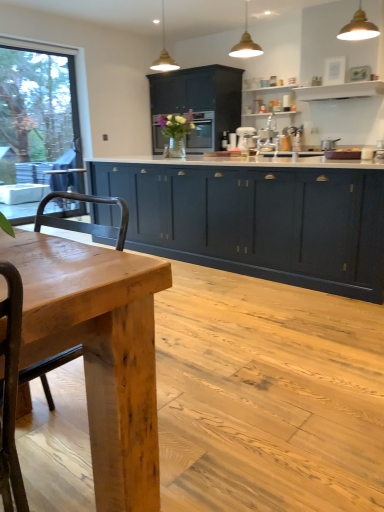
In order to face metallic gold pendant light at upper center, acting as the first light fixture starting from the front, should I rotate leftwards or rightwards?

It's best to rotate right around 21.420 degrees.

The image size is (384, 512). What do you see at coordinates (358, 27) in the screenshot?
I see `metallic gold pendant light at upper center, the 1th light fixture positioned from the right` at bounding box center [358, 27].

Identify the location of white glossy exhaust hood at upper center. Image resolution: width=384 pixels, height=512 pixels. (332, 97).

The image size is (384, 512). What do you see at coordinates (246, 42) in the screenshot?
I see `matte gold pendant light at upper center, which is the second light fixture from left to right` at bounding box center [246, 42].

Describe the element at coordinates (176, 131) in the screenshot. I see `translucent glass vase at center` at that location.

Identify the location of matte dark blue cabinets at center, the first cabinetry when ordered from bottom to top. The height and width of the screenshot is (512, 384). (258, 220).

Is white glossy exhaust hood at upper center oriented towards transparent glass window at left?

No, white glossy exhaust hood at upper center is not facing towards transparent glass window at left.

Considering the sizes of white glossy exhaust hood at upper center and transparent glass window at left in the image, is white glossy exhaust hood at upper center taller or shorter than transparent glass window at left?

white glossy exhaust hood at upper center is shorter than transparent glass window at left.

In terms of size, does white glossy exhaust hood at upper center appear bigger or smaller than transparent glass window at left?

white glossy exhaust hood at upper center is smaller than transparent glass window at left.

Which is behind, point (351, 98) or point (214, 116)?

The point (214, 116) is farther from the camera.

Could you tell me if white glossy exhaust hood at upper center is facing matte black oven at center?

No.

Does white glossy exhaust hood at upper center have a lesser width compared to matte black oven at center?

Correct, the width of white glossy exhaust hood at upper center is less than that of matte black oven at center.

Is point (175, 128) closer or farther from the camera than point (246, 137)?

Point (175, 128) is closer to the camera than point (246, 137).

I want to click on floral arrangement that appears in front of the satin silver coffee machine at center, so click(176, 131).

Between translucent glass vase at center and satin silver coffee machine at center, which one is positioned behind?

satin silver coffee machine at center is behind.

From the gold metallic pendant light at upper center, the 1th light fixture positioned from the left, count 2nd light fixture to the right and point to it. Please provide its 2D coordinates.

[(358, 27)]

From a real-world perspective, is metallic gold pendant light at upper center, the 1th light fixture positioned from the right, under gold metallic pendant light at upper center, the third light fixture positioned from the front?

Indeed, from a real-world perspective, metallic gold pendant light at upper center, the 1th light fixture positioned from the right, is positioned beneath gold metallic pendant light at upper center, the third light fixture positioned from the front.

Can you confirm if metallic gold pendant light at upper center, the 3th light fixture positioned from the left, is shorter than gold metallic pendant light at upper center, arranged as the first light fixture when viewed from the back?

Indeed, metallic gold pendant light at upper center, the 3th light fixture positioned from the left, has a lesser height compared to gold metallic pendant light at upper center, arranged as the first light fixture when viewed from the back.

Is metallic gold pendant light at upper center, marked as the 3th light fixture in a back-to-front arrangement, inside or outside of gold metallic pendant light at upper center, the 1th light fixture positioned from the left?

metallic gold pendant light at upper center, marked as the 3th light fixture in a back-to-front arrangement, lies outside gold metallic pendant light at upper center, the 1th light fixture positioned from the left.

How much distance is there between matte black oven at center and satin silver coffee machine at center?

The distance of matte black oven at center from satin silver coffee machine at center is 27.97 inches.

Would you say matte black oven at center is outside satin silver coffee machine at center?

Indeed, matte black oven at center is completely outside satin silver coffee machine at center.

Consider the image. Considering the sizes of objects matte black oven at center and satin silver coffee machine at center in the image provided, who is smaller, matte black oven at center or satin silver coffee machine at center?

satin silver coffee machine at center.

Which of these two, natural wood table at center or gold metallic pendant light at upper center, arranged as the first light fixture when viewed from the back, is wider?

natural wood table at center.

From a real-world perspective, which is physically below, natural wood table at center or gold metallic pendant light at upper center, the 1th light fixture positioned from the left?

In real-world perspective, natural wood table at center is lower.

Considering the relative sizes of natural wood table at center and gold metallic pendant light at upper center, the third light fixture in the right-to-left sequence, in the image provided, is natural wood table at center shorter than gold metallic pendant light at upper center, the third light fixture in the right-to-left sequence,?

Incorrect, the height of natural wood table at center does not fall short of that of gold metallic pendant light at upper center, the third light fixture in the right-to-left sequence.

Can you tell me how much natural wood table at center and gold metallic pendant light at upper center, the 1th light fixture positioned from the left, differ in facing direction?

There is a 2.09-degree angle between the facing directions of natural wood table at center and gold metallic pendant light at upper center, the 1th light fixture positioned from the left.

Does gold metallic pendant light at upper center, the 1th light fixture positioned from the left, turn towards metallic gold pendant light at upper center, marked as the 3th light fixture in a back-to-front arrangement?

No, gold metallic pendant light at upper center, the 1th light fixture positioned from the left, is not oriented towards metallic gold pendant light at upper center, marked as the 3th light fixture in a back-to-front arrangement.

Based on the photo, from their relative heights in the image, would you say gold metallic pendant light at upper center, the third light fixture positioned from the front, is taller or shorter than metallic gold pendant light at upper center, the 3th light fixture positioned from the left?

Considering their sizes, gold metallic pendant light at upper center, the third light fixture positioned from the front, has more height than metallic gold pendant light at upper center, the 3th light fixture positioned from the left.

From the picture: Who is bigger, gold metallic pendant light at upper center, arranged as the first light fixture when viewed from the back, or metallic gold pendant light at upper center, marked as the 3th light fixture in a back-to-front arrangement?

gold metallic pendant light at upper center, arranged as the first light fixture when viewed from the back, is bigger.

Between gold metallic pendant light at upper center, the third light fixture positioned from the front, and metallic gold pendant light at upper center, marked as the 3th light fixture in a back-to-front arrangement, which one appears on the right side from the viewer's perspective?

Positioned to the right is metallic gold pendant light at upper center, marked as the 3th light fixture in a back-to-front arrangement.

Locate an element on the screen. exhaust hood behind the transparent glass window at left is located at coordinates (332, 97).

The width and height of the screenshot is (384, 512). Find the location of `exhaust hood above the matte black oven at center (from a real-world perspective)`. exhaust hood above the matte black oven at center (from a real-world perspective) is located at coordinates (332, 97).

From the image, which object appears to be farther from gold metallic pendant light at upper center, arranged as the first light fixture when viewed from the back, transparent glass window at left or white glossy exhaust hood at upper center?

white glossy exhaust hood at upper center is further to gold metallic pendant light at upper center, arranged as the first light fixture when viewed from the back.

Based on their spatial positions, is matte dark blue cabinets at center, which appears as the second cabinetry when viewed from the top, or satin silver coffee machine at center closer to transparent glass window at left?

matte dark blue cabinets at center, which appears as the second cabinetry when viewed from the top, is positioned closer to the anchor transparent glass window at left.

Based on their spatial positions, is matte gold pendant light at upper center, the second light fixture from the back, or metallic gold pendant light at upper center, acting as the first light fixture starting from the front, further from transparent glass window at left?

metallic gold pendant light at upper center, acting as the first light fixture starting from the front, is further to transparent glass window at left.

Which object lies nearer to the anchor point satin silver coffee machine at center, matte dark blue cabinets at center, the 1th cabinetry from the front, or matte black oven at center?

matte black oven at center.

Based on their spatial positions, is matte dark blue cabinet at center, which is the 2th cabinetry in bottom-to-top order, or transparent glass window at left further from satin silver coffee machine at center?

transparent glass window at left is positioned further to the anchor satin silver coffee machine at center.

Looking at the image, which one is located further to transparent glass window at left, satin silver coffee machine at center or matte dark blue cabinet at center, the 1th cabinetry from the back?

satin silver coffee machine at center.

Which object lies nearer to the anchor point translucent glass vase at center, transparent glass window at left or satin silver coffee machine at center?

Among the two, satin silver coffee machine at center is located nearer to translucent glass vase at center.

Estimate the real-world distances between objects in this image. Which object is closer to matte black oven at center, transparent glass window at left or matte dark blue cabinets at center, the first cabinetry when ordered from bottom to top?

matte dark blue cabinets at center, the first cabinetry when ordered from bottom to top.

This screenshot has height=512, width=384. Identify the location of light fixture between matte gold pendant light at upper center, which ranks as the 2th light fixture in right-to-left order, and matte black oven at center, along the z-axis. (164, 54).

Identify the location of screen door between transparent glass window at left and satin silver coffee machine at center in the horizontal direction. This screenshot has width=384, height=512. (201, 133).

Where is `cabinetry between gold metallic pendant light at upper center, arranged as the first light fixture when viewed from the back, and matte black oven at center from front to back`? The width and height of the screenshot is (384, 512). cabinetry between gold metallic pendant light at upper center, arranged as the first light fixture when viewed from the back, and matte black oven at center from front to back is located at coordinates (198, 104).

I want to click on floral arrangement between matte dark blue cabinets at center, the 1th cabinetry from the front, and white glossy exhaust hood at upper center in the front-back direction, so click(x=176, y=131).